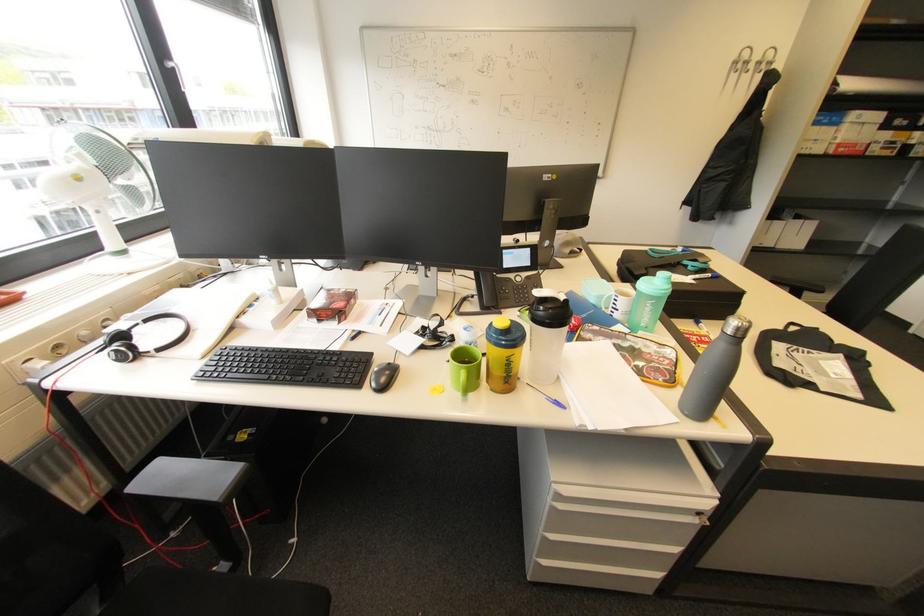
Which object does [140,339] point to?

It refers to a black headphones.